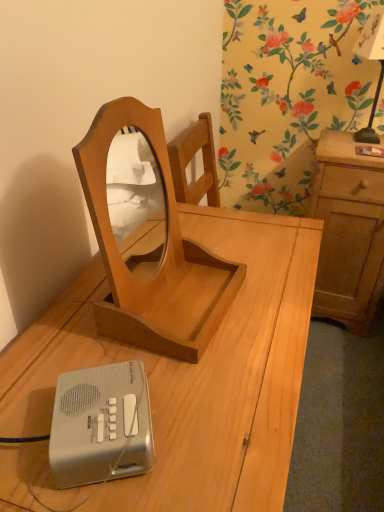
Where is `free location in front of light brown wood cabinet at right`? free location in front of light brown wood cabinet at right is located at coordinates (336, 366).